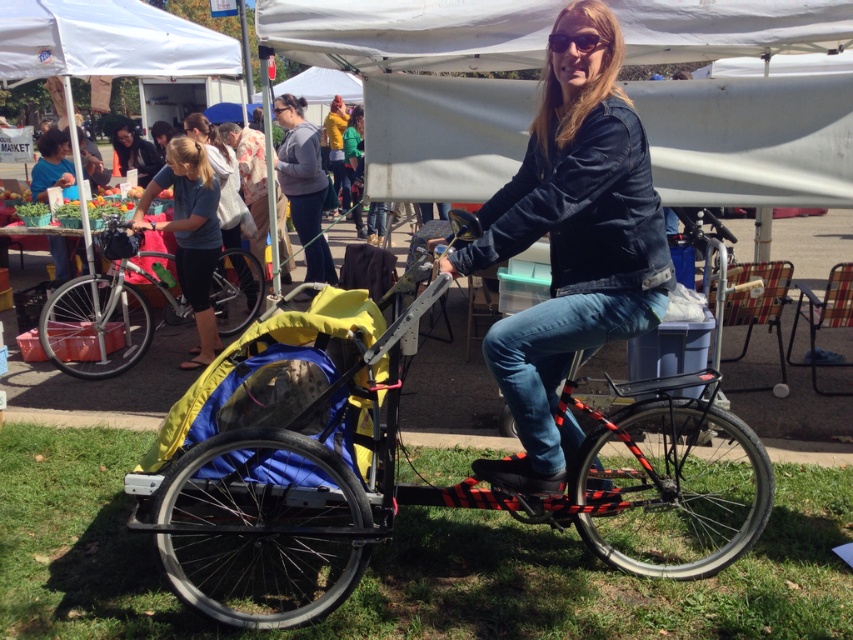
Question: Is denim jacket at center above silver metallic bicycle at center?

Choices:
 (A) yes
 (B) no

Answer: (A)

Question: Is black plastic tricycle at center bigger than gray fleece hoodie at center?

Choices:
 (A) no
 (B) yes

Answer: (B)

Question: Which of the following is the closest to the observer?

Choices:
 (A) black plastic tricycle at center
 (B) blue fabric bag at center
 (C) denim jacket at center

Answer: (C)

Question: Estimate the real-world distances between objects in this image. Which object is closer to the black plastic tricycle at center?

Choices:
 (A) denim jacket at center
 (B) gray fleece hoodie at center

Answer: (A)

Question: Which point is closer to the camera?

Choices:
 (A) (67, 372)
 (B) (117, 152)

Answer: (A)

Question: Does blue fabric bag at center lie in front of gray fleece hoodie at center?

Choices:
 (A) no
 (B) yes

Answer: (B)